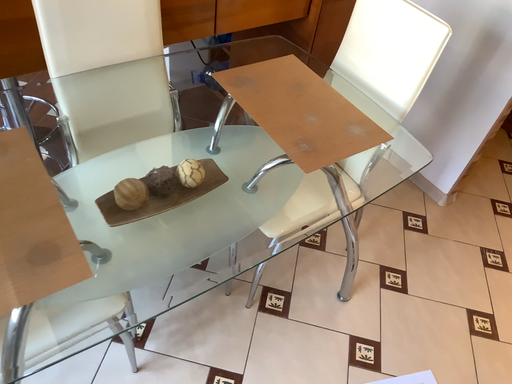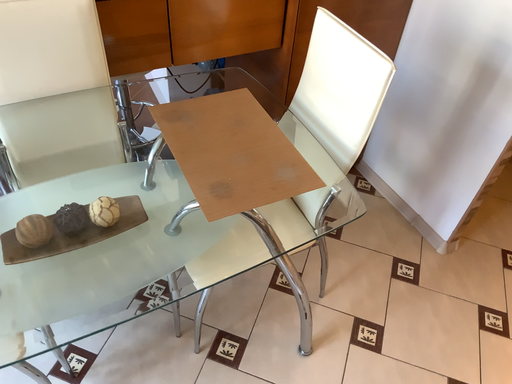
Question: Which way did the camera rotate in the video?

Choices:
 (A) rotated left
 (B) rotated right

Answer: (A)